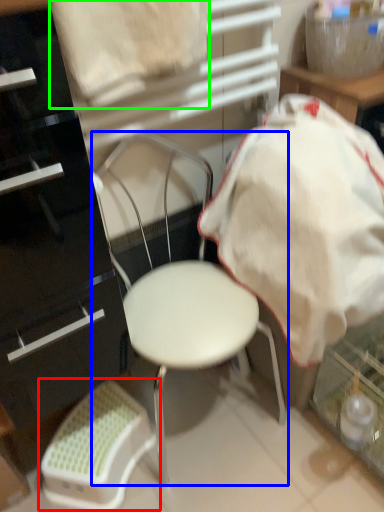
Question: Which object is positioned closest to bar stool (highlighted by a red box)? Select from chair (highlighted by a blue box) and sheet (highlighted by a green box).

Choices:
 (A) chair
 (B) sheet

Answer: (A)